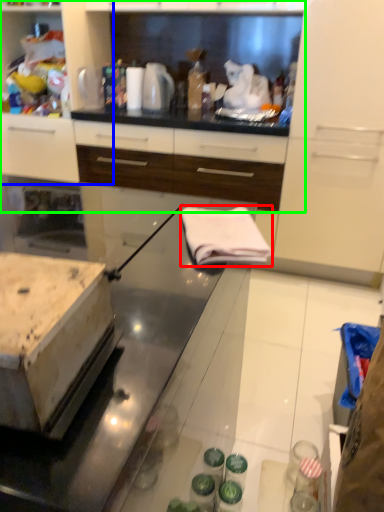
Question: Which object is the closest to the cloth (highlighted by a red box)? Choose among these: cabinetry (highlighted by a blue box) or cabinetry (highlighted by a green box).

Choices:
 (A) cabinetry
 (B) cabinetry

Answer: (B)